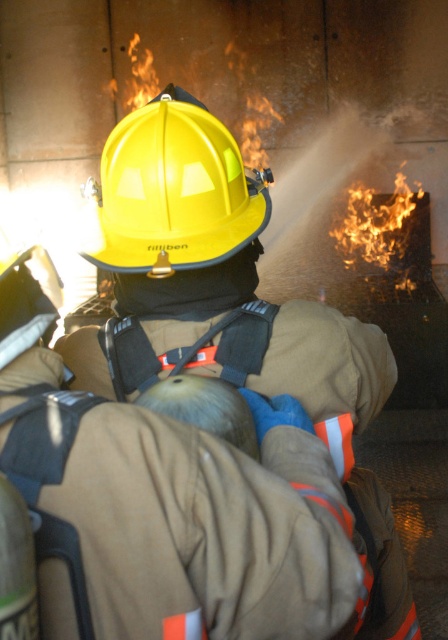
You are a firefighter trainee standing 1.5 meters away from the yellow hard hat at center. Your instructor asks you to grab it quickly. Is it within your reach without moving your feet?

The yellow hard hat at center is 1.04 meters away from viewer. Since you are standing 1.5 meters away, it is slightly out of reach without moving your feet.